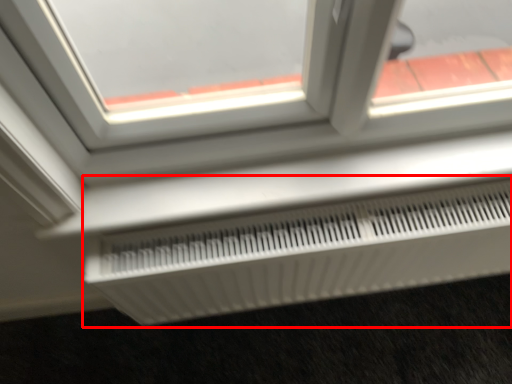
Question: Considering the relative positions of air conditioning (annotated by the red box) and window in the image provided, where is air conditioning (annotated by the red box) located with respect to the staircase?

Choices:
 (A) left
 (B) right

Answer: (B)